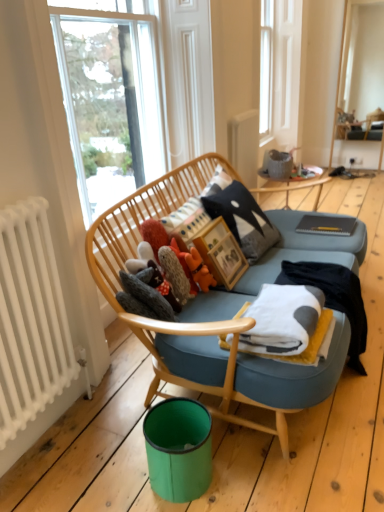
Question: Does matte gray notebook at center have a greater height compared to fluffy orange toy at center, marked as the first toy in a right-to-left arrangement?

Choices:
 (A) yes
 (B) no

Answer: (B)

Question: Does matte gray notebook at center appear on the left side of fluffy orange toy at center, acting as the 3th toy starting from the left?

Choices:
 (A) no
 (B) yes

Answer: (A)

Question: From the image's perspective, would you say matte gray notebook at center is positioned over fluffy orange toy at center, marked as the first toy in a right-to-left arrangement?

Choices:
 (A) yes
 (B) no

Answer: (A)

Question: Can you confirm if matte gray notebook at center is positioned to the right of fluffy orange toy at center, marked as the first toy in a right-to-left arrangement?

Choices:
 (A) no
 (B) yes

Answer: (B)

Question: From a real-world perspective, is matte gray notebook at center located higher than fluffy orange toy at center, marked as the first toy in a right-to-left arrangement?

Choices:
 (A) no
 (B) yes

Answer: (A)

Question: Is matte gray notebook at center facing away from fluffy orange toy at center, marked as the first toy in a right-to-left arrangement?

Choices:
 (A) yes
 (B) no

Answer: (B)

Question: Is fluffy fabric stuffed animals at center, which is the second toy in left-to-right order, placed right next to wooden table at center?

Choices:
 (A) yes
 (B) no

Answer: (B)

Question: Does fluffy fabric stuffed animals at center, which is the second toy in left-to-right order, have a larger size compared to wooden table at center?

Choices:
 (A) yes
 (B) no

Answer: (B)

Question: Can you confirm if fluffy fabric stuffed animals at center, which is the second toy in left-to-right order, is positioned to the right of wooden table at center?

Choices:
 (A) no
 (B) yes

Answer: (A)

Question: From a real-world perspective, is fluffy fabric stuffed animals at center, which is the second toy in left-to-right order, physically below wooden table at center?

Choices:
 (A) no
 (B) yes

Answer: (A)

Question: Does fluffy fabric stuffed animals at center, which is the second toy in left-to-right order, lie in front of wooden table at center?

Choices:
 (A) no
 (B) yes

Answer: (B)

Question: Does fluffy fabric stuffed animals at center, the 2th toy from the right, have a greater height compared to wooden table at center?

Choices:
 (A) no
 (B) yes

Answer: (B)

Question: Is matte gray vase at upper center facing away from fuzzy gray stuffed animal at center, the first toy when ordered from left to right?

Choices:
 (A) no
 (B) yes

Answer: (A)